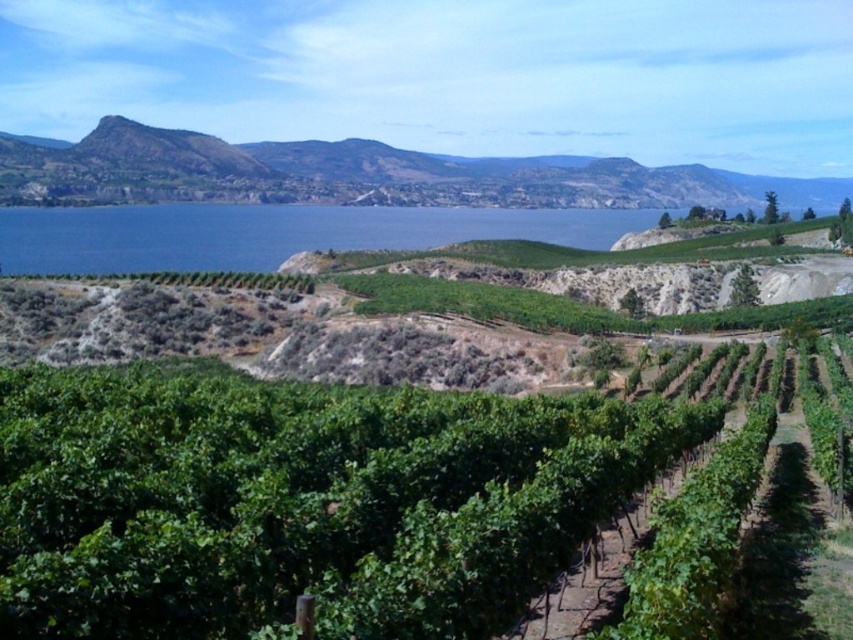
Question: Which object is positioned farthest from the green leafy hillside at upper center?

Choices:
 (A) blue water at center
 (B) green leafy vines at center

Answer: (B)

Question: Considering the relative positions of green leafy vines at center and green leafy hillside at upper center in the image provided, where is green leafy vines at center located with respect to green leafy hillside at upper center?

Choices:
 (A) above
 (B) below

Answer: (B)

Question: Which is nearer to the green leafy vines at center?

Choices:
 (A) green leafy hillside at upper center
 (B) blue water at center

Answer: (B)

Question: Which object appears farthest from the camera in this image?

Choices:
 (A) green leafy vines at center
 (B) blue water at center

Answer: (B)

Question: Does green leafy vines at center come in front of green leafy hillside at upper center?

Choices:
 (A) no
 (B) yes

Answer: (B)

Question: From the image, what is the correct spatial relationship of green leafy hillside at upper center in relation to blue water at center?

Choices:
 (A) right
 (B) left

Answer: (A)